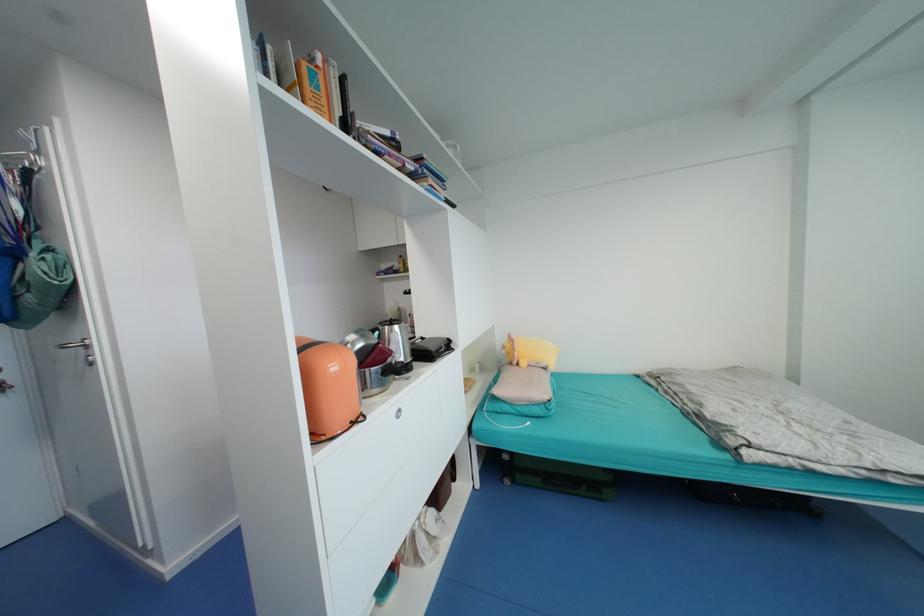
What do you see at coordinates (80, 349) in the screenshot?
I see `the silver door handle` at bounding box center [80, 349].